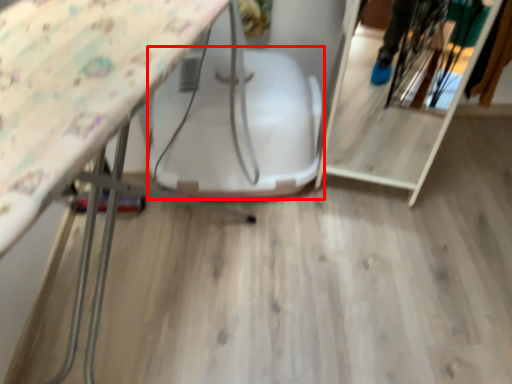
Question: From the image's perspective, what is the correct spatial relationship of swivel chair (annotated by the red box) in relation to shelf?

Choices:
 (A) below
 (B) above

Answer: (A)